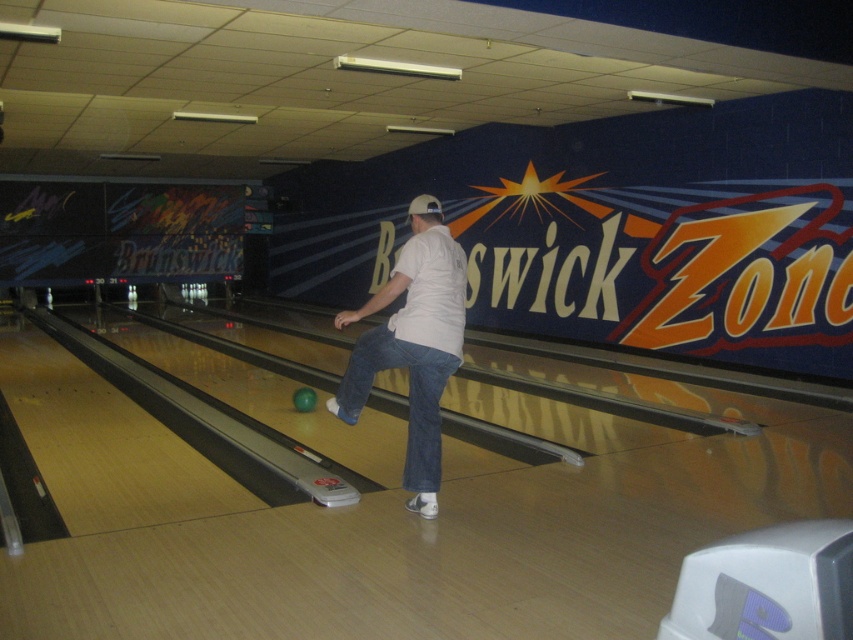
Is point (416, 440) positioned after point (312, 403)?

No, (416, 440) is closer to viewer.

Is jeans at center positioned behind green matte bowling ball at center?

No.

Is point (347, 372) behind point (300, 404)?

That is False.

At what (x,y) coordinates should I click in order to perform the action: click on jeans at center. Please return your answer as a coordinate pair (x, y). Looking at the image, I should click on 408,396.

Does white cotton shirt at center appear on the left side of green matte bowling ball at center?

Incorrect, white cotton shirt at center is not on the left side of green matte bowling ball at center.

Who is more distant from viewer, (442, 276) or (311, 401)?

Point (311, 401)

Describe the element at coordinates (412, 342) in the screenshot. The width and height of the screenshot is (853, 640). I see `white cotton shirt at center` at that location.

Locate an element on the screen. The width and height of the screenshot is (853, 640). white cotton shirt at center is located at coordinates (412, 342).

Which is above, white cotton shirt at center or jeans at center?

white cotton shirt at center is higher up.

Does white cotton shirt at center lie in front of jeans at center?

Yes, it is in front of jeans at center.

Between point (381, 336) and point (427, 481), which one is positioned behind?

The point (427, 481) is more distant.

Identify the location of white cotton shirt at center. The image size is (853, 640). (412, 342).